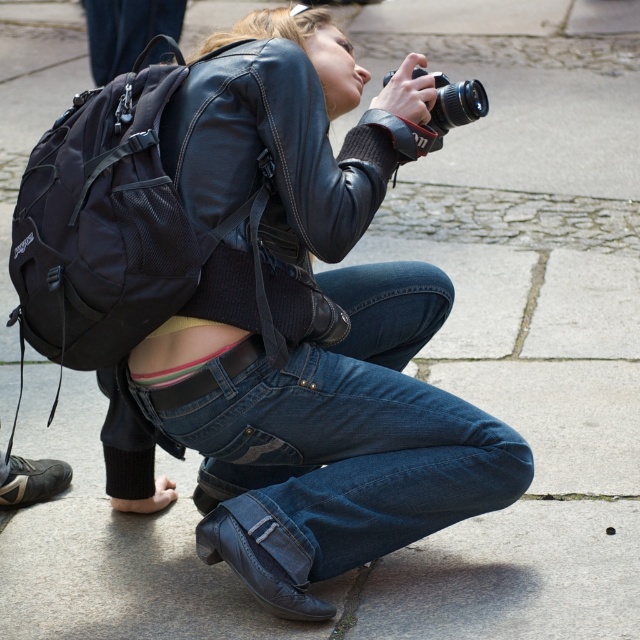
You are a photographer trying to decide where to place your camera. You have a denim at center and a black matte camera at upper center. Which object takes up more space in the image?

The denim at center takes up more space in the image because it is bigger than the black matte camera at upper center.

What is the exact coordinate of the denim at center in the image?

The denim at center is located at point (340, 435).